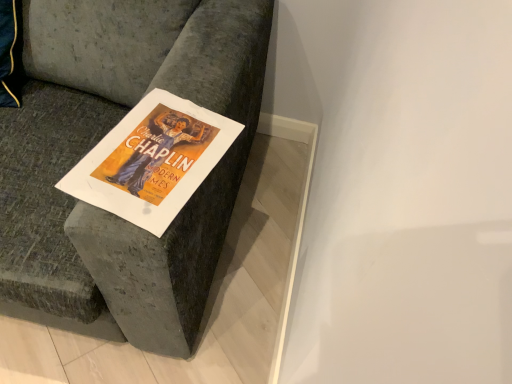
Locate an element on the screen. This screenshot has width=512, height=384. free point above orange paper poster at center (from a real-world perspective) is located at coordinates (154, 152).